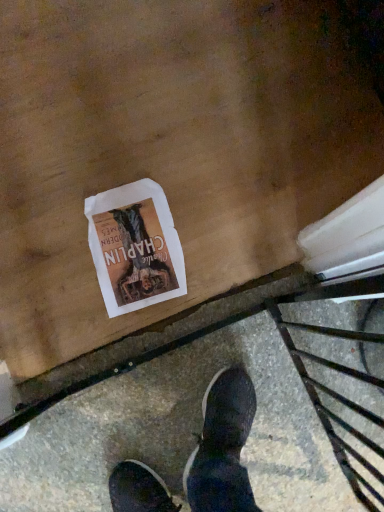
In order to click on vacant space in front of white paper flyer at center in this screenshot , I will do `click(123, 336)`.